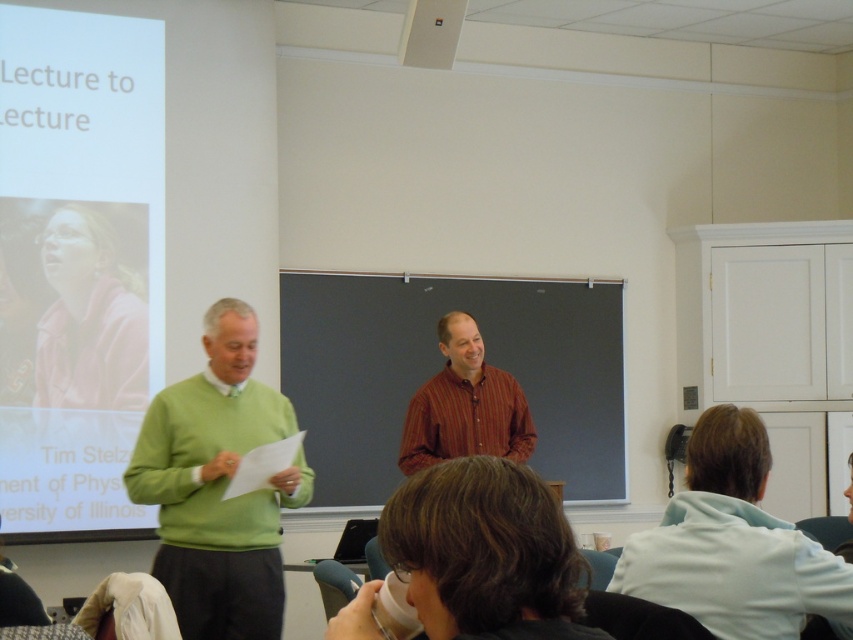
Question: Where is green sweater at left located in relation to striped cotton shirt at center in the image?

Choices:
 (A) above
 (B) below

Answer: (B)

Question: Is green sweater at left to the right of striped cotton shirt at center from the viewer's perspective?

Choices:
 (A) no
 (B) yes

Answer: (A)

Question: Does green sweater at left appear on the right side of striped cotton shirt at center?

Choices:
 (A) no
 (B) yes

Answer: (A)

Question: Which point appears farthest from the camera in this image?

Choices:
 (A) (228, 561)
 (B) (473, 339)

Answer: (B)